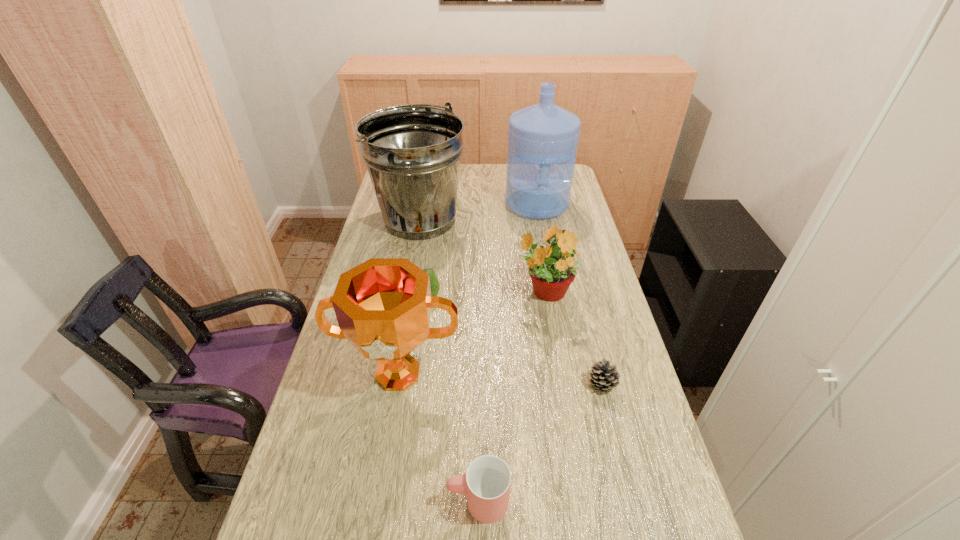
This screenshot has height=540, width=960. In order to click on water jug in this screenshot , I will do `click(543, 138)`.

Find the location of `bucket`. bucket is located at coordinates (412, 152).

Where is `award`? The width and height of the screenshot is (960, 540). award is located at coordinates (383, 306).

Identify the location of flowerpot. (552, 267).

Locate an element on the screen. avocado is located at coordinates (434, 283).

Where is `cup`? Image resolution: width=960 pixels, height=540 pixels. cup is located at coordinates (486, 484).

The height and width of the screenshot is (540, 960). I want to click on pinecone, so click(604, 377).

I want to click on vacant space situated on the side of the water jug with the handle, so click(548, 264).

At what (x,y) coordinates should I click in order to perform the action: click on vacant space located on the right of the sixth shortest object. Please return your answer as a coordinate pair (x, y). Image resolution: width=960 pixels, height=540 pixels. Looking at the image, I should click on (550, 220).

Find the location of a particular element. This screenshot has width=960, height=540. vacant space located on the side of the award with the star emblem is located at coordinates (371, 537).